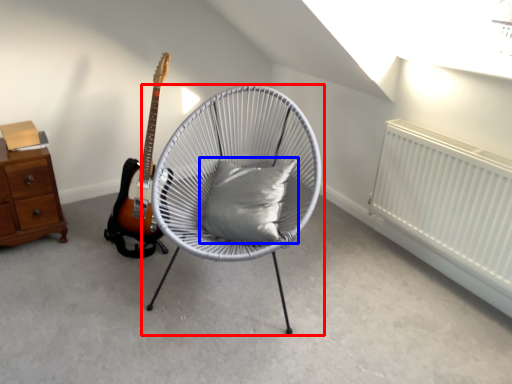
Question: Which point is closer to the camera, chair (highlighted by a red box) or pillow (highlighted by a blue box)?

Choices:
 (A) chair
 (B) pillow

Answer: (A)